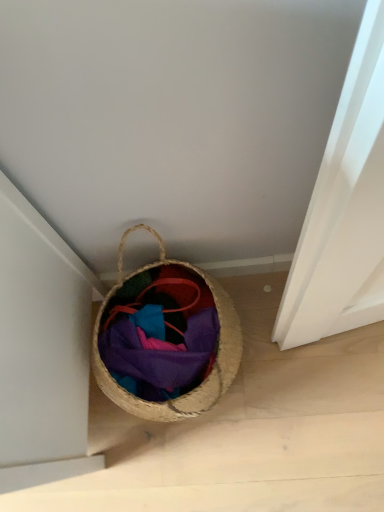
This screenshot has height=512, width=384. I want to click on matte woven basket at center, so 160,341.

What do you see at coordinates (160, 341) in the screenshot?
I see `matte woven basket at center` at bounding box center [160, 341].

What are the coordinates of `braided straw basket at lower center` in the screenshot? It's located at (166, 340).

The width and height of the screenshot is (384, 512). What do you see at coordinates (166, 340) in the screenshot?
I see `braided straw basket at lower center` at bounding box center [166, 340].

You are a GUI agent. You are given a task and a screenshot of the screen. Output one action in this format:
    pyautogui.click(x=<x>, y=<y>)
    Task: Click on the matte woven basket at center
    The width and height of the screenshot is (384, 512).
    Given the screenshot: What is the action you would take?
    pyautogui.click(x=160, y=341)

Does braided straw basket at lower center appear on the right side of matte woven basket at center?

Incorrect, braided straw basket at lower center is not on the right side of matte woven basket at center.

Considering their positions, is braided straw basket at lower center located in front of or behind matte woven basket at center?

braided straw basket at lower center is positioned closer to the viewer than matte woven basket at center.

Considering the points (159, 324) and (189, 275), which point is in front, point (159, 324) or point (189, 275)?

The point (159, 324) is in front.

Based on the photo, from the image's perspective, between braided straw basket at lower center and matte woven basket at center, who is located below?

matte woven basket at center.

From a real-world perspective, is braided straw basket at lower center on matte woven basket at center?

Correct, in the physical world, braided straw basket at lower center is higher than matte woven basket at center.

Can you confirm if braided straw basket at lower center is wider than matte woven basket at center?

Correct, the width of braided straw basket at lower center exceeds that of matte woven basket at center.

Is braided straw basket at lower center taller than matte woven basket at center?

Indeed, braided straw basket at lower center has a greater height compared to matte woven basket at center.

Considering the sizes of braided straw basket at lower center and matte woven basket at center in the image, is braided straw basket at lower center bigger or smaller than matte woven basket at center?

Considering their sizes, braided straw basket at lower center takes up more space than matte woven basket at center.

Is braided straw basket at lower center spatially inside matte woven basket at center, or outside of it?

braided straw basket at lower center is not enclosed by matte woven basket at center.

Would you consider braided straw basket at lower center to be distant from matte woven basket at center?

No, braided straw basket at lower center is in close proximity to matte woven basket at center.

Is braided straw basket at lower center aimed at matte woven basket at center?

Yes.

Can you tell me how much braided straw basket at lower center and matte woven basket at center differ in facing direction?

5.58 degrees.

Find the location of `clothing behind the braided straw basket at lower center`. clothing behind the braided straw basket at lower center is located at coordinates (160, 341).

Is matte woven basket at center at the right side of braided straw basket at lower center?

Yes.

Which object is more forward, matte woven basket at center or braided straw basket at lower center?

braided straw basket at lower center is closer to the camera.

Is point (164, 321) less distant than point (156, 381)?

That is False.

From the image's perspective, is matte woven basket at center above braided straw basket at lower center?

No, from the image's perspective, matte woven basket at center is not on top of braided straw basket at lower center.

From a real-world perspective, which is physically below, matte woven basket at center or braided straw basket at lower center?

matte woven basket at center is physically lower.

Is matte woven basket at center wider or thinner than braided straw basket at lower center?

Considering their sizes, matte woven basket at center looks slimmer than braided straw basket at lower center.

From the picture: Who is shorter, matte woven basket at center or braided straw basket at lower center?

With less height is matte woven basket at center.

Does matte woven basket at center have a smaller size compared to braided straw basket at lower center?

Yes, matte woven basket at center is smaller than braided straw basket at lower center.

Looking at this image, does matte woven basket at center contain braided straw basket at lower center?

No.

Is matte woven basket at center positioned far away from braided straw basket at lower center?

That's not correct — matte woven basket at center is a little close to braided straw basket at lower center.

Is matte woven basket at center positioned with its back to braided straw basket at lower center?

That's right, matte woven basket at center is facing away from braided straw basket at lower center.

What's the angular difference between matte woven basket at center and braided straw basket at lower center's facing directions?

The angle between the facing direction of matte woven basket at center and the facing direction of braided straw basket at lower center is 5.58 degrees.

This screenshot has width=384, height=512. Identify the location of picnic basket that appears on the left of matte woven basket at center. (166, 340).

You are a GUI agent. You are given a task and a screenshot of the screen. Output one action in this format:
    pyautogui.click(x=<x>, y=<y>)
    Task: Click on the picnic basket lying above the matte woven basket at center (from the image's perspective)
    
    Given the screenshot: What is the action you would take?
    pyautogui.click(x=166, y=340)

Image resolution: width=384 pixels, height=512 pixels. In the image, there is a braided straw basket at lower center. Find the location of `clothing below it (from the image's perspective)`. clothing below it (from the image's perspective) is located at coordinates (160, 341).